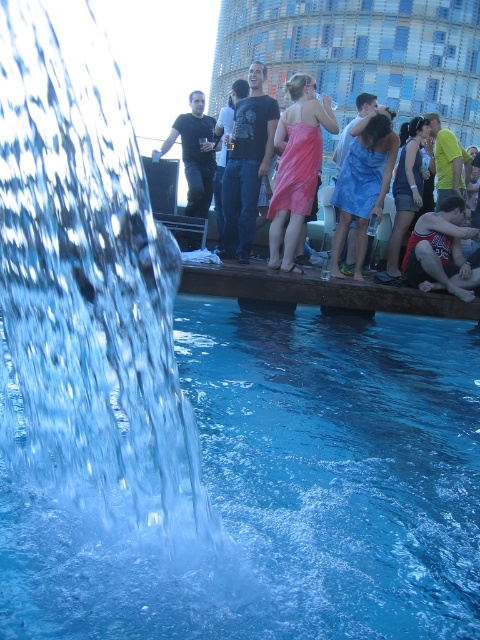
You are at the poolside event and see the pink satin dress at center and the matte black shirt at upper center. Which one is positioned lower in the scene?

The pink satin dress at center is positioned below the matte black shirt at upper center, so it is lower in the scene.